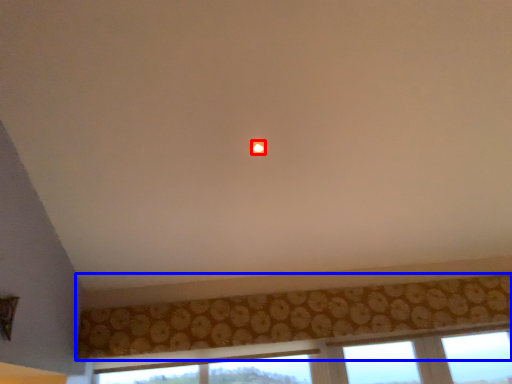
Question: Which of the following is the closest to the observer, glow (highlighted by a red box) or curtain (highlighted by a blue box)?

Choices:
 (A) glow
 (B) curtain

Answer: (A)